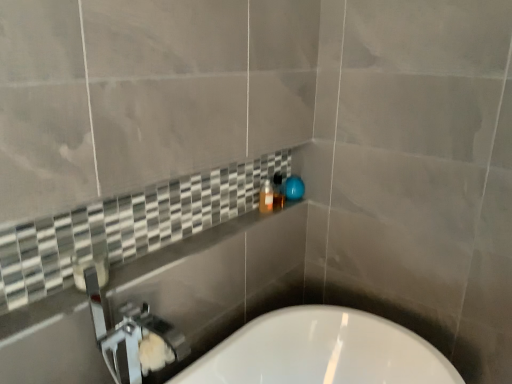
Question: Do you think white glossy bathtub at lower center is within translucent plastic bottle at upper center, or outside of it?

Choices:
 (A) outside
 (B) inside

Answer: (A)

Question: Is white glossy bathtub at lower center taller or shorter than translucent plastic bottle at upper center?

Choices:
 (A) short
 (B) tall

Answer: (B)

Question: Considering the real-world distances, which object is closest to the translucent plastic bottle at upper center?

Choices:
 (A) white glossy bathtub at lower center
 (B) matte black soap dispenser at center

Answer: (B)

Question: Based on their relative distances, which object is farther from the translucent plastic bottle at upper center?

Choices:
 (A) white glossy bathtub at lower center
 (B) matte black soap dispenser at center

Answer: (A)